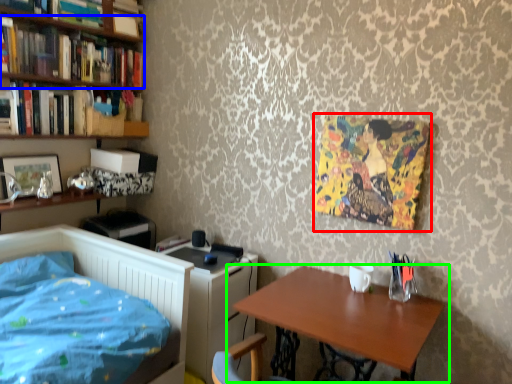
Question: Which object is positioned farthest from art (highlighted by a red box)? Select from book (highlighted by a blue box) and table (highlighted by a green box).

Choices:
 (A) book
 (B) table

Answer: (A)